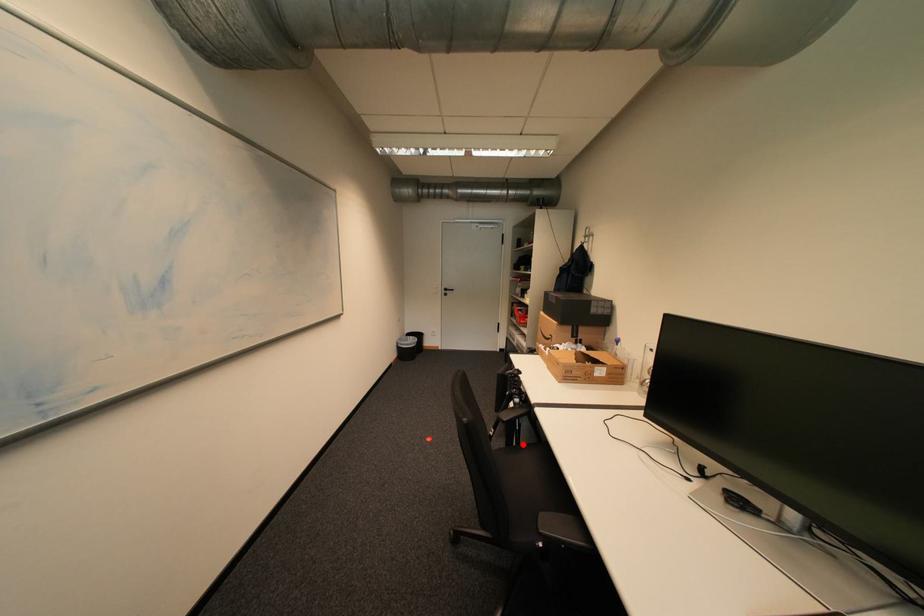
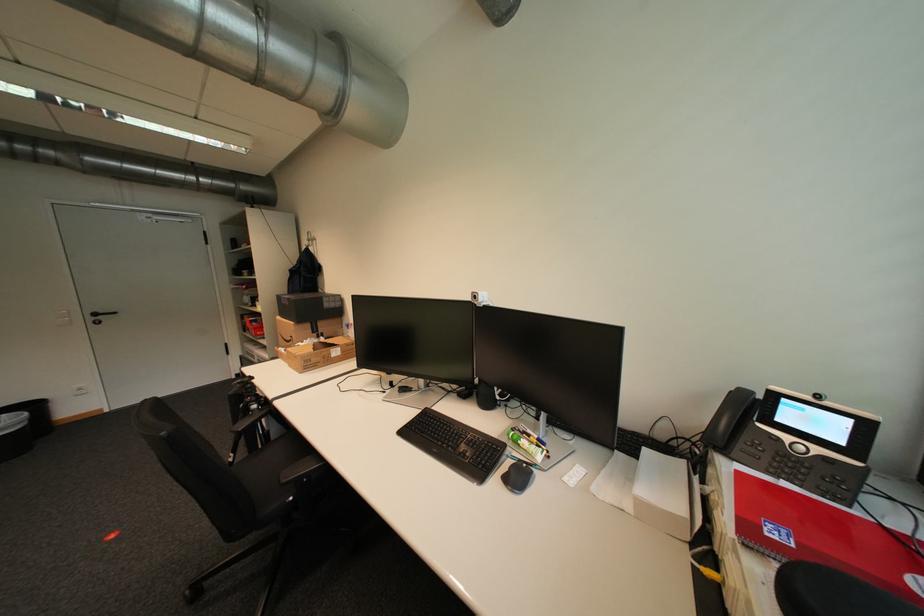
Question: I am providing you with two images of the same scene from different viewpoints. Given a red point in image1, look at the same physical point in image2. Is it:

Choices:
 (A) Closer to the viewpoint
 (B) Farther from the viewpoint

Answer: (A)